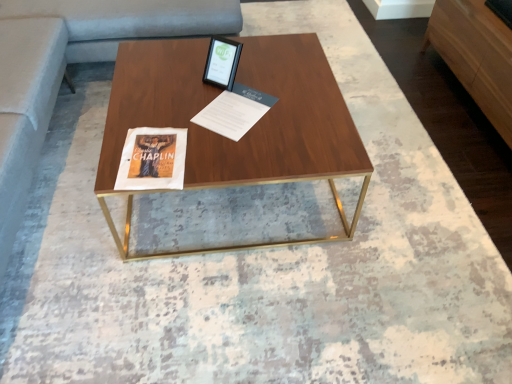
The image size is (512, 384). Identify the location of free space to the right of white paper at center. (294, 109).